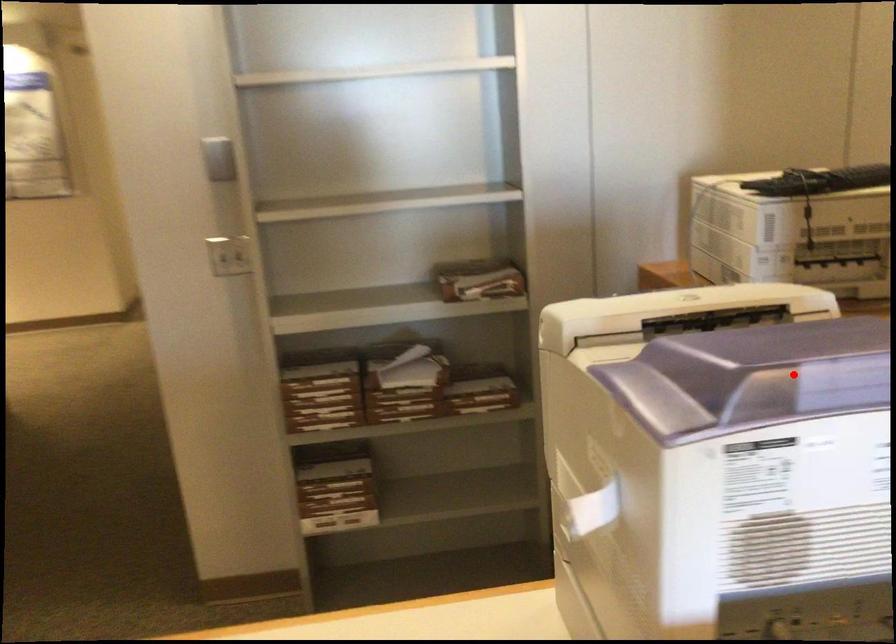
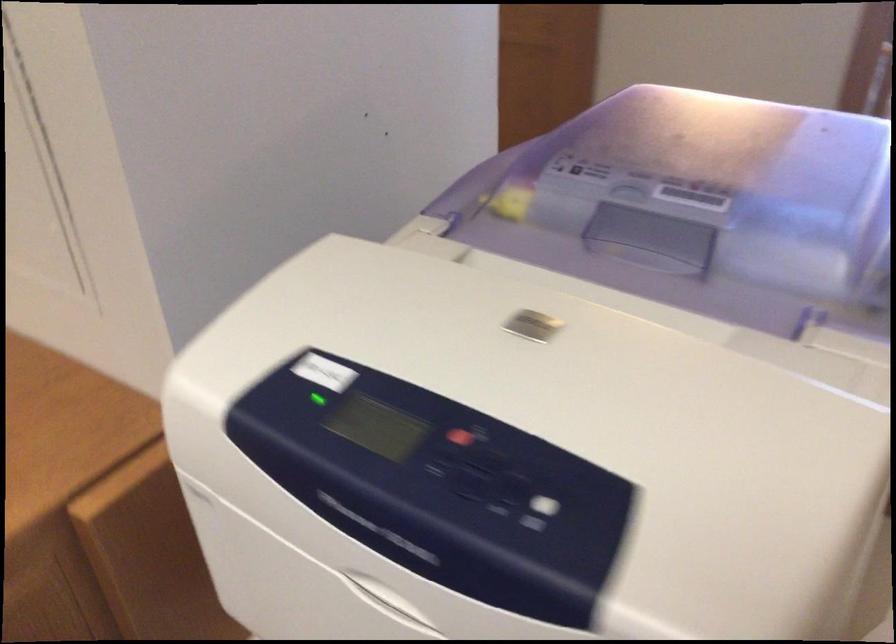
Question: I am providing you with two images of the same scene from different viewpoints. Image1 has a red point marked. In image2, the corresponding 3D location appears at what relative position? Reply with the corresponding letter.

Choices:
 (A) Closer
 (B) Farther

Answer: (A)